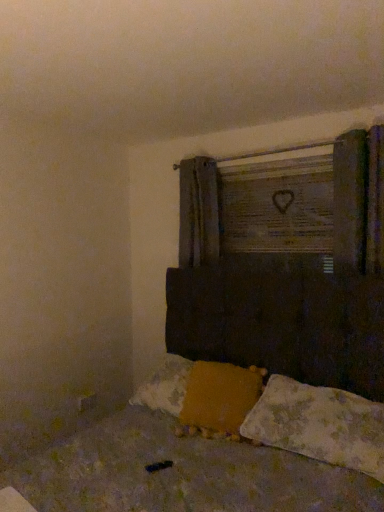
Question: Does yellow fabric pillow at lower center, marked as the second pillow in a right-to-left arrangement, have a larger size compared to wooden sign at upper center?

Choices:
 (A) yes
 (B) no

Answer: (A)

Question: From the image's perspective, is yellow fabric pillow at lower center, marked as the second pillow in a right-to-left arrangement, below wooden sign at upper center?

Choices:
 (A) yes
 (B) no

Answer: (A)

Question: Does yellow fabric pillow at lower center, marked as the second pillow in a right-to-left arrangement, have a smaller size compared to wooden sign at upper center?

Choices:
 (A) no
 (B) yes

Answer: (A)

Question: Considering the relative positions of yellow fabric pillow at lower center, marked as the second pillow in a right-to-left arrangement, and wooden sign at upper center in the image provided, is yellow fabric pillow at lower center, marked as the second pillow in a right-to-left arrangement, in front of wooden sign at upper center?

Choices:
 (A) no
 (B) yes

Answer: (B)

Question: Is yellow fabric pillow at lower center, which is counted as the 1th pillow, starting from the left, oriented towards wooden sign at upper center?

Choices:
 (A) no
 (B) yes

Answer: (A)

Question: Is the surface of yellow fabric pillow at lower center, which is counted as the 1th pillow, starting from the left, in direct contact with wooden sign at upper center?

Choices:
 (A) yes
 (B) no

Answer: (B)

Question: Does wooden sign at upper center have a lesser height compared to dark brown wooden bed at center?

Choices:
 (A) no
 (B) yes

Answer: (B)

Question: From the image's perspective, would you say wooden sign at upper center is positioned over dark brown wooden bed at center?

Choices:
 (A) no
 (B) yes

Answer: (B)

Question: From a real-world perspective, is wooden sign at upper center physically below dark brown wooden bed at center?

Choices:
 (A) yes
 (B) no

Answer: (B)

Question: Is wooden sign at upper center not near dark brown wooden bed at center?

Choices:
 (A) no
 (B) yes

Answer: (B)

Question: Is wooden sign at upper center completely or partially outside of dark brown wooden bed at center?

Choices:
 (A) yes
 (B) no

Answer: (A)

Question: Is wooden sign at upper center facing towards dark brown wooden bed at center?

Choices:
 (A) yes
 (B) no

Answer: (B)

Question: From the image's perspective, is wooden sign at upper center over fluffy white pillow at lower right, the 2th pillow viewed from the left?

Choices:
 (A) yes
 (B) no

Answer: (A)